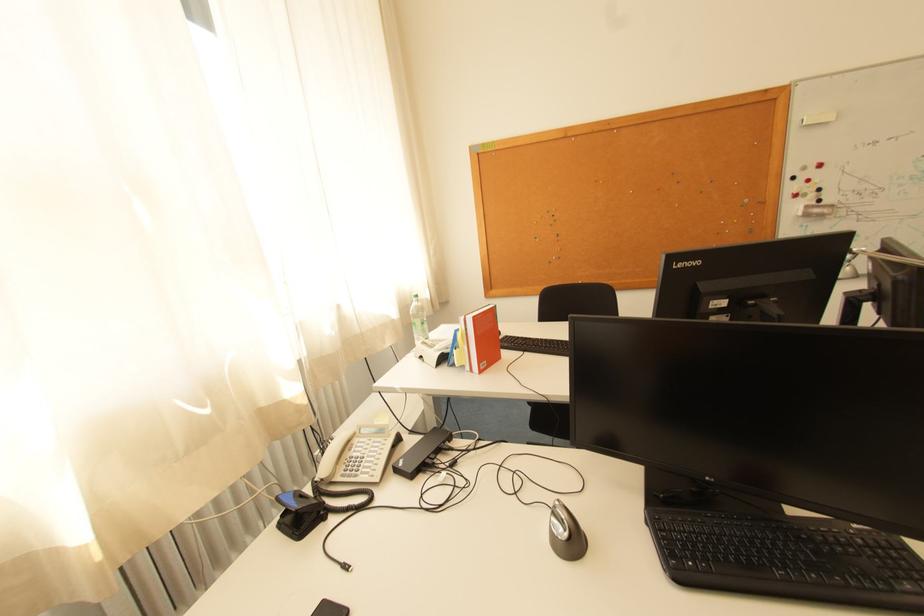
Image resolution: width=924 pixels, height=616 pixels. In order to click on computer mouse in this screenshot , I will do `click(565, 533)`.